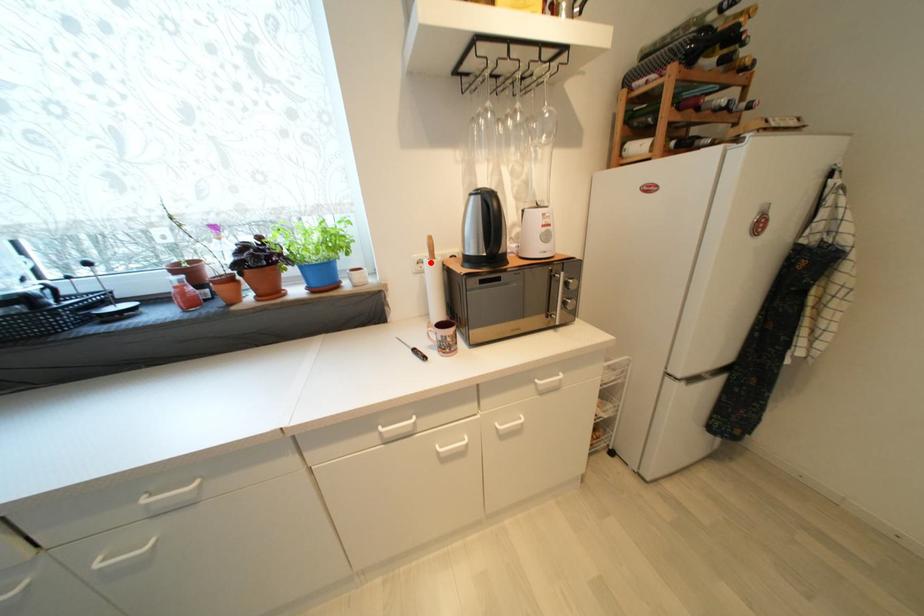
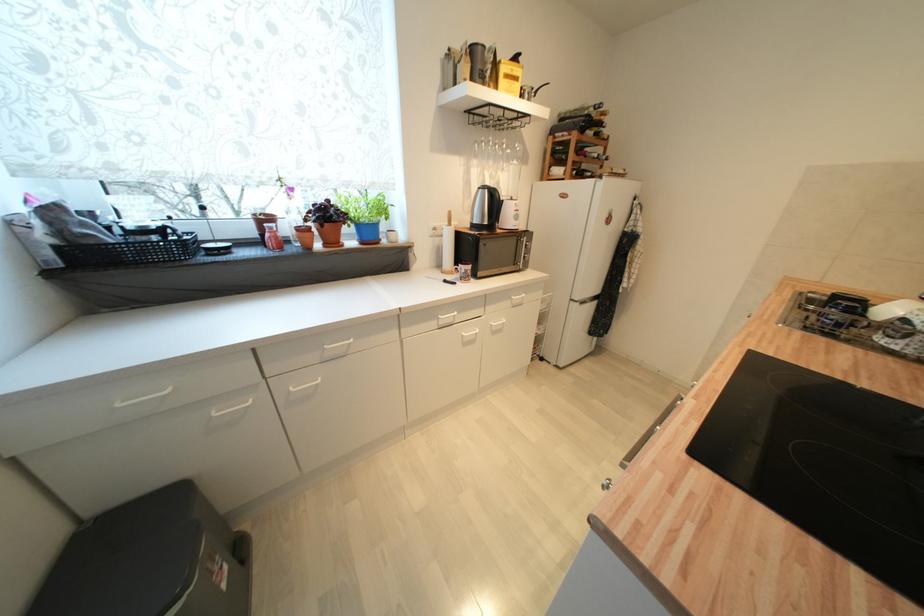
Question: I am providing you with two images of the same scene from different viewpoints. A red point is marked on the first image. At the location where the point appears in image 1, is it still visible in image 2?

Choices:
 (A) Yes
 (B) No

Answer: (A)